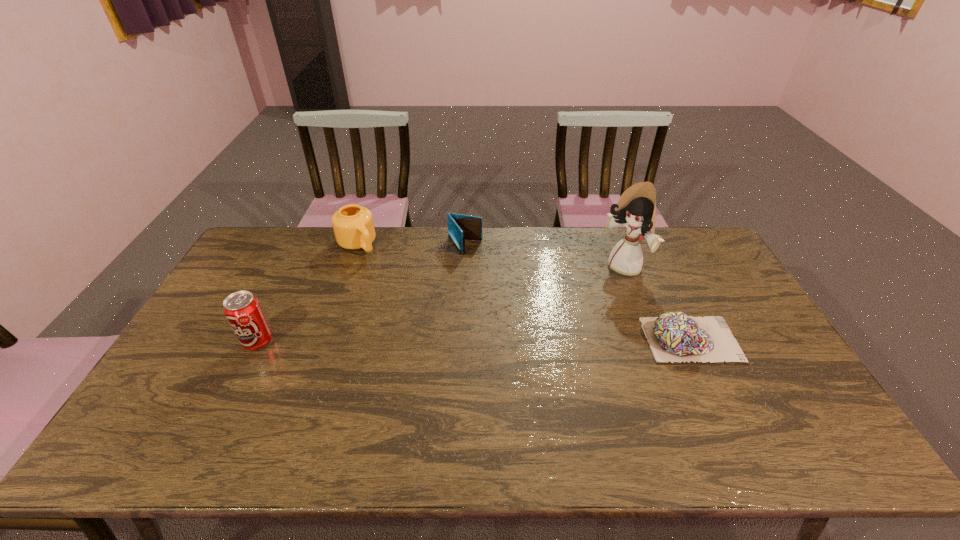
The width and height of the screenshot is (960, 540). What are the coordinates of `vacant area that lies between the doll and the shortest object` in the screenshot? It's located at (657, 303).

What are the coordinates of `free space between the second object from left to right and the shortest object` in the screenshot? It's located at (524, 292).

The height and width of the screenshot is (540, 960). Find the location of `free spot between the tallest object and the third shortest object`. free spot between the tallest object and the third shortest object is located at coordinates (491, 256).

Locate an element on the screen. This screenshot has width=960, height=540. free spot between the leftmost object and the doll is located at coordinates (441, 305).

Find the location of a particular element. free space between the second object from left to right and the shortest object is located at coordinates (524, 292).

At what (x,y) coordinates should I click in order to perform the action: click on empty space that is in between the soda and the third shortest object. Please return your answer as a coordinate pair (x, y). Looking at the image, I should click on (308, 293).

The height and width of the screenshot is (540, 960). In order to click on free spot between the soda and the cap in this screenshot , I will do `click(474, 341)`.

Where is `free spot between the doll and the cap`? The image size is (960, 540). free spot between the doll and the cap is located at coordinates (657, 303).

This screenshot has height=540, width=960. I want to click on vacant space in between the fourth object from right to left and the leftmost object, so click(308, 293).

Identify which object is the third closest to the shortest object. Please provide its 2D coordinates. Your answer should be formatted as a tuple, i.e. [(x, y)], where the tuple contains the x and y coordinates of a point satisfying the conditions above.

[(353, 225)]